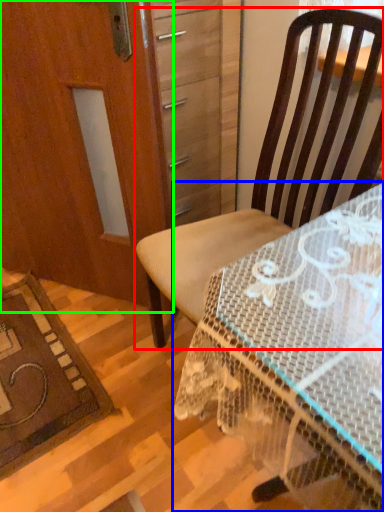
Question: Which is farther away from chair (highlighted by a red box)? desk (highlighted by a blue box) or screen door (highlighted by a green box)?

Choices:
 (A) desk
 (B) screen door

Answer: (B)